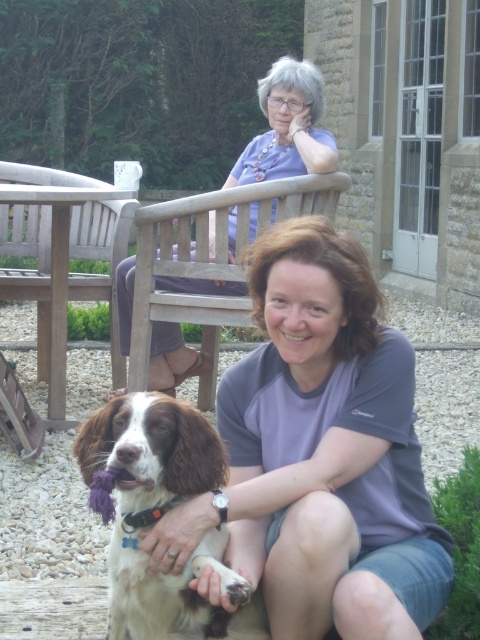
Question: Can you confirm if white fur dog at lower left is bigger than wooden park bench at upper center?

Choices:
 (A) yes
 (B) no

Answer: (B)

Question: Which of the following is the closest to the observer?

Choices:
 (A) (61, 240)
 (B) (284, 326)
 (C) (264, 170)

Answer: (B)

Question: Does matte gray shirt at center have a greater width compared to matte purple blouse at upper center?

Choices:
 (A) yes
 (B) no

Answer: (B)

Question: Estimate the real-world distances between objects in this image. Which object is closer to the matte gray shirt at center?

Choices:
 (A) wooden park bench at upper center
 (B) matte purple blouse at upper center
 (C) white fur dog at lower left

Answer: (C)

Question: Which object is closer to the camera taking this photo?

Choices:
 (A) wooden park bench at upper center
 (B) white fur dog at lower left
 (C) matte purple blouse at upper center
 (D) matte gray shirt at center

Answer: (D)

Question: Observing the image, what is the correct spatial positioning of white fur dog at lower left in reference to matte purple blouse at upper center?

Choices:
 (A) right
 (B) left

Answer: (A)